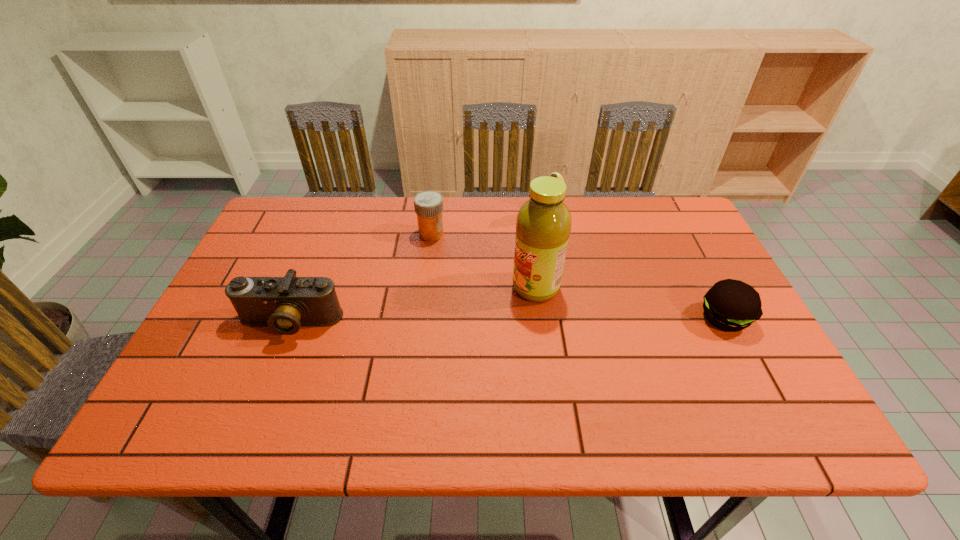
The height and width of the screenshot is (540, 960). Identify the location of object that is at the right edge. (731, 305).

Find the location of `vacant space at the far edge of the desktop`. vacant space at the far edge of the desktop is located at coordinates (628, 213).

Identify the location of blank space at the near edge of the desktop. 373,379.

You are a GUI agent. You are given a task and a screenshot of the screen. Output one action in this format:
    pyautogui.click(x=<x>, y=<y>)
    Task: Click on the free space at the left edge of the desktop
    
    Given the screenshot: What is the action you would take?
    pyautogui.click(x=268, y=263)

Locate an element on the screen. The height and width of the screenshot is (540, 960). vacant point at the right edge is located at coordinates (709, 278).

Where is `free point at the near left corner`? free point at the near left corner is located at coordinates pyautogui.click(x=224, y=367).

Where is `vacant space at the far right corner of the desktop`? The image size is (960, 540). vacant space at the far right corner of the desktop is located at coordinates (683, 218).

The image size is (960, 540). Identify the location of vacant area at the near right corner of the desktop. (754, 382).

The width and height of the screenshot is (960, 540). What are the coordinates of `vacant region between the leftmost object and the medicine` in the screenshot? It's located at (361, 278).

Where is `vacant area between the tallest object and the patty`? vacant area between the tallest object and the patty is located at coordinates (630, 303).